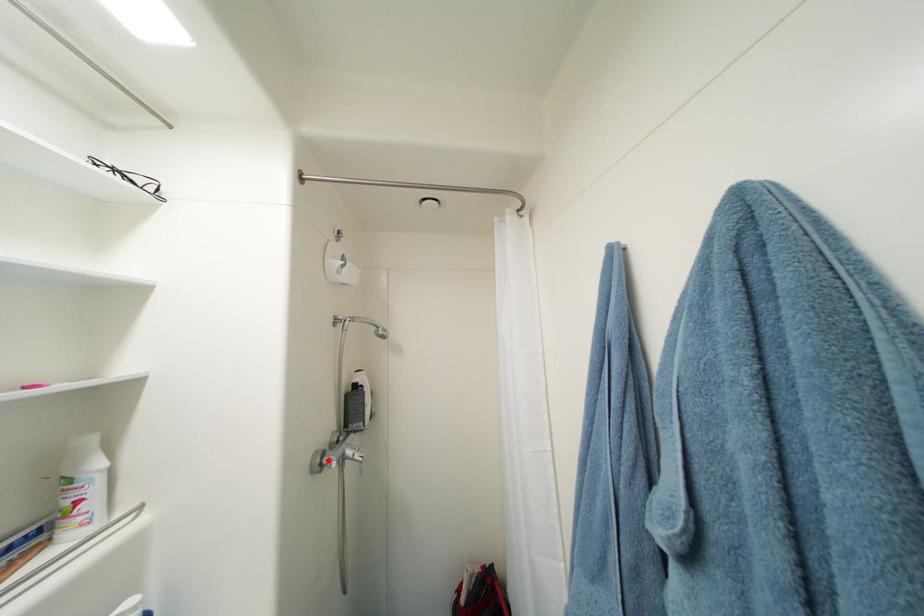
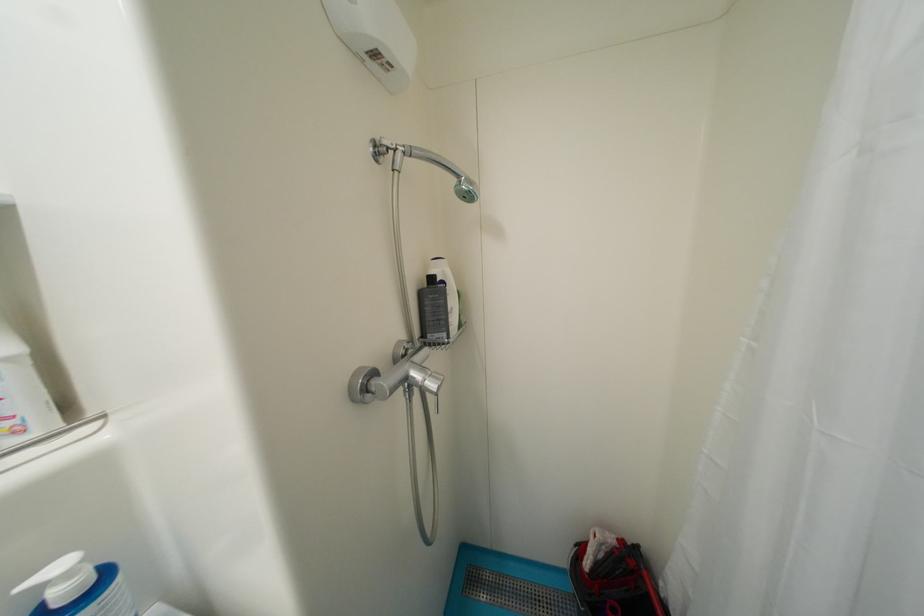
In the second image, find the point that corresponds to the highlighted location in the first image.

(374, 383)